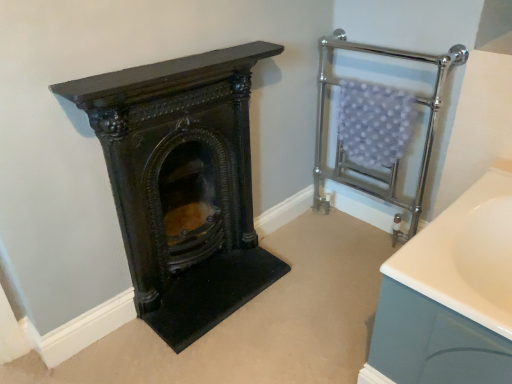
The width and height of the screenshot is (512, 384). What are the coordinates of `free location in front of dark brown wood at left` in the screenshot? It's located at (226, 349).